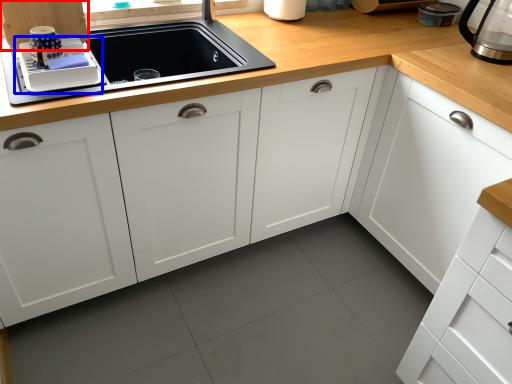
Question: Which object is closer to the camera taking this photo, cabinetry (highlighted by a red box) or appliance (highlighted by a blue box)?

Choices:
 (A) cabinetry
 (B) appliance

Answer: (A)